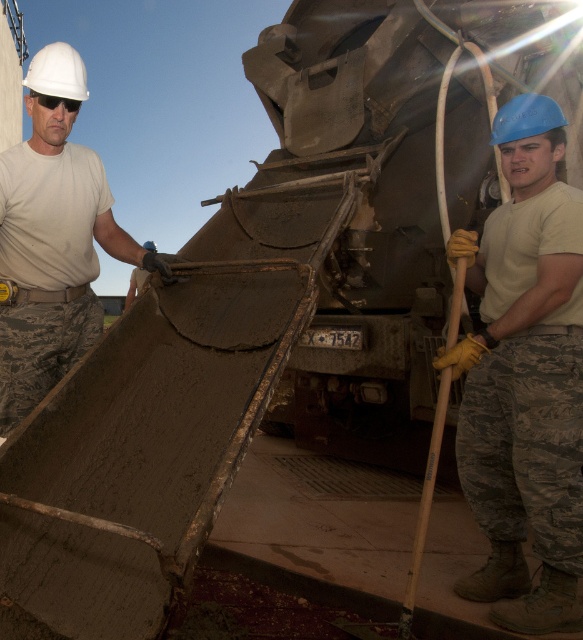
Question: In this image, where is blue hard hat at upper right located relative to matte white helmet at upper left?

Choices:
 (A) above
 (B) below

Answer: (B)

Question: Does blue hard hat at upper right appear on the left side of matte white helmet at upper left?

Choices:
 (A) yes
 (B) no

Answer: (B)

Question: In this image, where is blue hard hat at upper right located relative to matte white helmet at upper left?

Choices:
 (A) below
 (B) above

Answer: (A)

Question: Which point is farther from the camera taking this photo?

Choices:
 (A) click(x=2, y=422)
 (B) click(x=476, y=461)

Answer: (A)